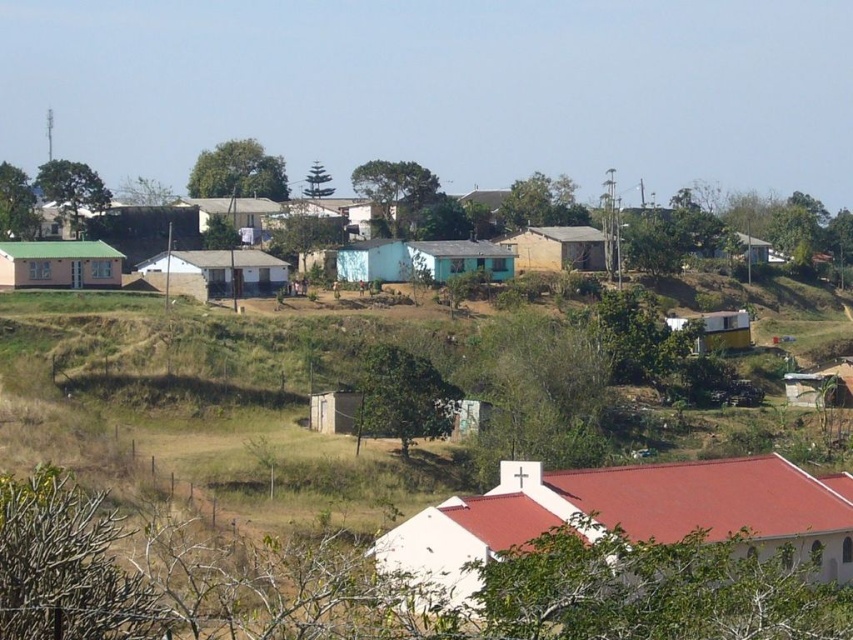
Question: Based on their relative distances, which object is farther from the white matte house at center?

Choices:
 (A) white plastic hut at right
 (B) matte green house at left

Answer: (A)

Question: Is matte green house at left closer to the viewer compared to white plastic hut at right?

Choices:
 (A) yes
 (B) no

Answer: (A)

Question: Is white matte church at lower center in front of light blue painted wood house at center?

Choices:
 (A) no
 (B) yes

Answer: (B)

Question: Which of these objects is positioned farthest from the light blue painted wood house at center?

Choices:
 (A) white plastic hut at right
 (B) light brown wooden hut at upper right
 (C) white matte church at lower center
 (D) matte green house at left

Answer: (C)

Question: Is light blue painted wood house at center below light brown wooden hut at upper right?

Choices:
 (A) no
 (B) yes

Answer: (B)

Question: Which of the following is the farthest from the observer?

Choices:
 (A) white matte house at center
 (B) white matte church at lower center

Answer: (A)